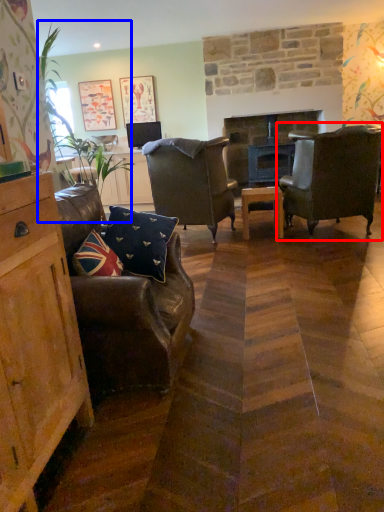
Question: Which of the following is the farthest to the observer, chair (highlighted by a red box) or plant (highlighted by a blue box)?

Choices:
 (A) chair
 (B) plant

Answer: (A)